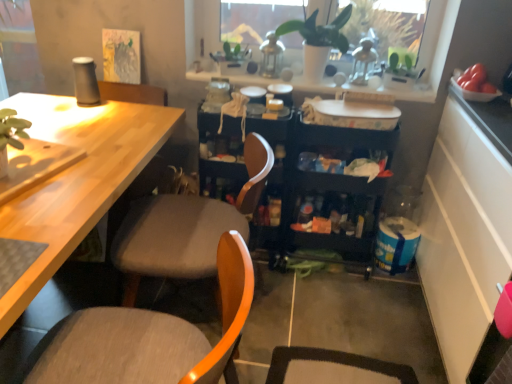
Question: Is white textured tray at upper center in front of or behind green matte plant at upper center in the image?

Choices:
 (A) behind
 (B) front

Answer: (A)

Question: Is white textured tray at upper center bigger or smaller than green matte plant at upper center?

Choices:
 (A) big
 (B) small

Answer: (B)

Question: Which is nearer to the light wood desk at left?

Choices:
 (A) wooden chair at center, which appears as the second chair when viewed from the back
 (B) fabric cushioned chair at center, the 1th chair from the back
 (C) white textured tray at upper center
 (D) black plastic storage cart at center
 (E) white matte plant pot at upper center

Answer: (B)

Question: Which is farther from the white textured tray at upper center?

Choices:
 (A) black plastic storage cart at center
 (B) green matte plant at upper center
 (C) fabric cushioned chair at center, positioned as the 2th chair in front-to-back order
 (D) light wood desk at left
 (E) wooden chair at center, which appears as the second chair when viewed from the back

Answer: (E)